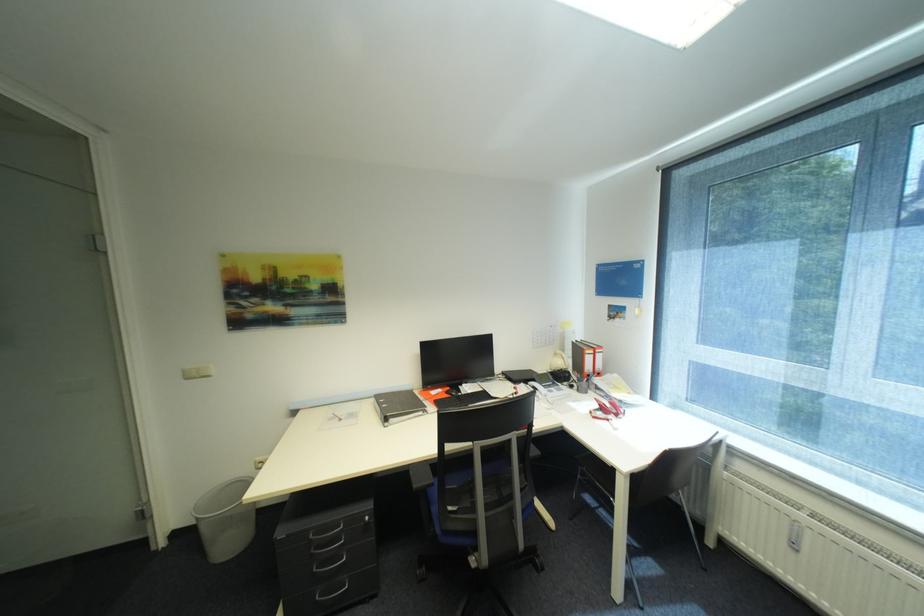
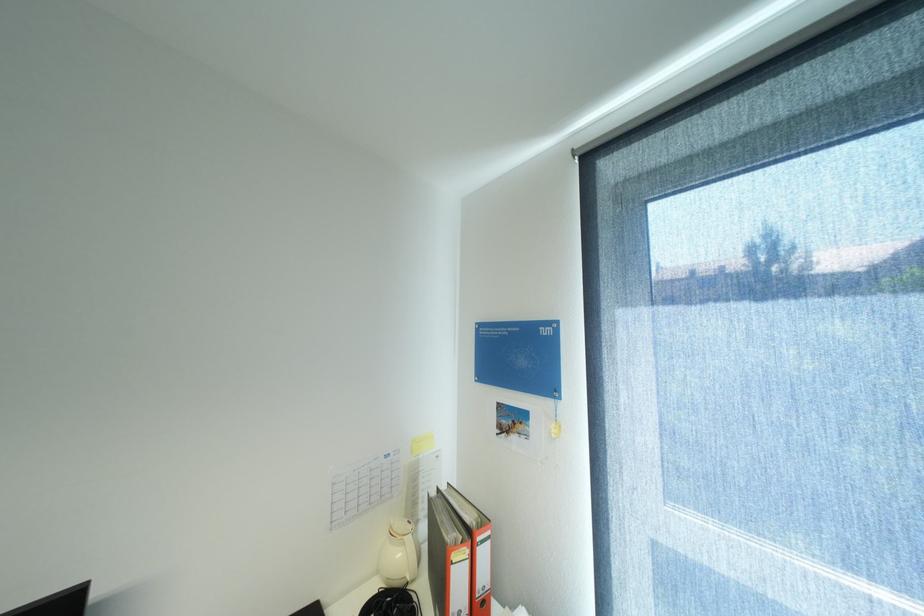
The point at (567, 363) is marked in the first image. Where is the corresponding point in the second image?

(407, 554)